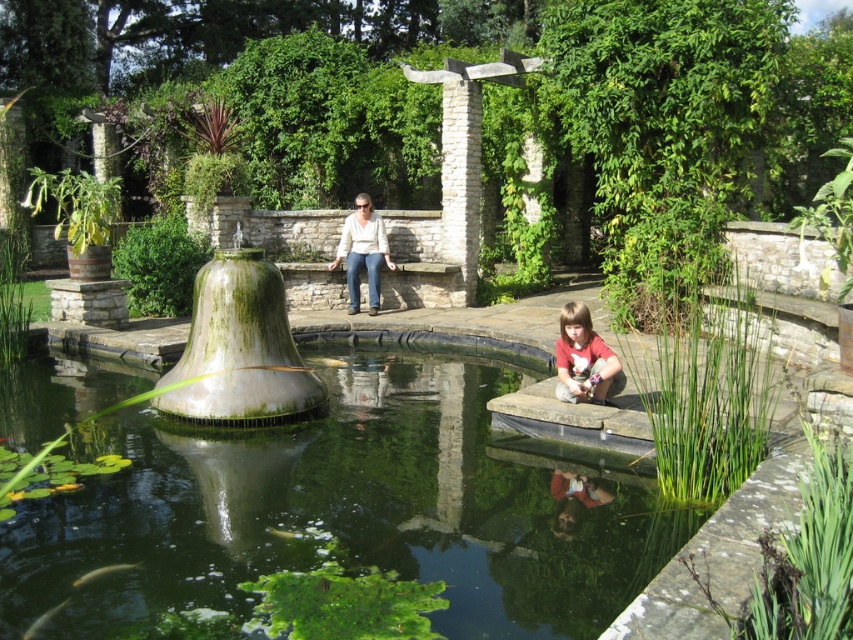
Question: Which object is positioned closest to the shiny silver fish at lower left?

Choices:
 (A) green mossy stone bell at center-left
 (B) green mossy stone at lower center
 (C) translucent green fish at lower center
 (D) light beige sweater at center

Answer: (C)

Question: Which of the following is the farthest from the observer?

Choices:
 (A) (412, 500)
 (B) (207, 312)
 (C) (33, 634)
 (D) (614, 356)

Answer: (B)

Question: Which object is farther from the camera taking this photo?

Choices:
 (A) matte red shirt at lower right
 (B) green mossy stone at lower center
 (C) shiny silver fish at lower left

Answer: (A)

Question: Is light beige sweater at center closer to the viewer compared to translucent green fish at lower center?

Choices:
 (A) yes
 (B) no

Answer: (B)

Question: Is green mossy stone bell at center-left thinner than translucent green fish at lower center?

Choices:
 (A) yes
 (B) no

Answer: (B)

Question: Is matte red shirt at lower right wider than shiny silver fish at lower left?

Choices:
 (A) yes
 (B) no

Answer: (A)